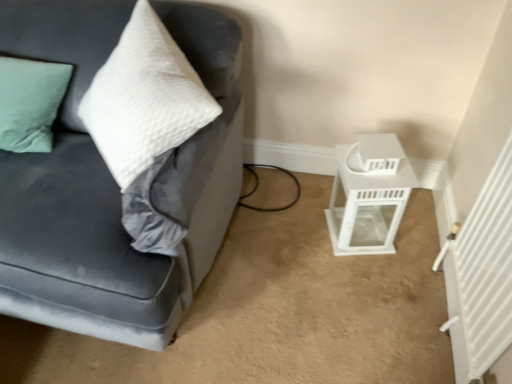
This screenshot has width=512, height=384. Describe the element at coordinates (369, 195) in the screenshot. I see `white glossy lantern at lower right` at that location.

The height and width of the screenshot is (384, 512). Find the location of `white glossy lantern at lower right`. white glossy lantern at lower right is located at coordinates (369, 195).

This screenshot has height=384, width=512. Describe the element at coordinates (93, 201) in the screenshot. I see `velvet gray couch at left` at that location.

You are a GUI agent. You are given a task and a screenshot of the screen. Output one action in this format:
    pyautogui.click(x=<x>, y=<y>)
    Task: Click on the velvet gray couch at left
    Image resolution: width=512 pixels, height=384 pixels.
    Given the screenshot: What is the action you would take?
    pyautogui.click(x=93, y=201)

In order to click on white glossy lantern at lower right in this screenshot , I will do pos(369,195).

Is velvet gray couch at left at the right side of white glossy lantern at lower right?

In fact, velvet gray couch at left is to the left of white glossy lantern at lower right.

Which object is more forward, velvet gray couch at left or white glossy lantern at lower right?

velvet gray couch at left is more forward.

Is point (94, 323) more distant than point (343, 216)?

That is False.

From the image's perspective, is velvet gray couch at left located beneath white glossy lantern at lower right?

No, from the image's perspective, velvet gray couch at left is not beneath white glossy lantern at lower right.

From a real-world perspective, which is physically below, velvet gray couch at left or white glossy lantern at lower right?

white glossy lantern at lower right.

Can you confirm if velvet gray couch at left is thinner than white glossy lantern at lower right?

In fact, velvet gray couch at left might be wider than white glossy lantern at lower right.

Is velvet gray couch at left taller or shorter than white glossy lantern at lower right?

In the image, velvet gray couch at left appears to be taller than white glossy lantern at lower right.

Which of these two, velvet gray couch at left or white glossy lantern at lower right, is smaller?

Smaller between the two is white glossy lantern at lower right.

Is velvet gray couch at left not within white glossy lantern at lower right?

Yes.

Would you say velvet gray couch at left is a long distance from white glossy lantern at lower right?

No.

Is white glossy lantern at lower right at the back of velvet gray couch at left?

No, velvet gray couch at left's orientation is not away from white glossy lantern at lower right.

How different are the orientations of velvet gray couch at left and white glossy lantern at lower right in degrees?

The angle between the facing direction of velvet gray couch at left and the facing direction of white glossy lantern at lower right is 16.9 degrees.

Find the location of a particular element. This screenshot has height=384, width=512. studio couch above the white glossy lantern at lower right (from a real-world perspective) is located at coordinates (93, 201).

Would you say white glossy lantern at lower right is to the left or to the right of velvet gray couch at left in the picture?

From the image, it's evident that white glossy lantern at lower right is to the right of velvet gray couch at left.

Which object is further away from the camera, white glossy lantern at lower right or velvet gray couch at left?

white glossy lantern at lower right.

Which is behind, point (383, 223) or point (54, 178)?

The point (383, 223) is more distant.

From the image's perspective, would you say white glossy lantern at lower right is positioned over velvet gray couch at left?

No, from the image's perspective, white glossy lantern at lower right is not above velvet gray couch at left.

From a real-world perspective, which object rests below the other?

In real-world perspective, white glossy lantern at lower right is lower.

Which object is wider, white glossy lantern at lower right or velvet gray couch at left?

velvet gray couch at left.

Which of these two, white glossy lantern at lower right or velvet gray couch at left, stands shorter?

white glossy lantern at lower right is shorter.

Considering the sizes of objects white glossy lantern at lower right and velvet gray couch at left in the image provided, who is bigger, white glossy lantern at lower right or velvet gray couch at left?

velvet gray couch at left.

Is white glossy lantern at lower right surrounding velvet gray couch at left?

Actually, velvet gray couch at left is outside white glossy lantern at lower right.

Are white glossy lantern at lower right and velvet gray couch at left making contact?

No, white glossy lantern at lower right is not next to velvet gray couch at left.

Is white glossy lantern at lower right aimed at velvet gray couch at left?

No, white glossy lantern at lower right does not turn towards velvet gray couch at left.

How many degrees apart are the facing directions of white glossy lantern at lower right and velvet gray couch at left?

They differ by 16.9 degrees in their facing directions.

Where is `studio couch above the white glossy lantern at lower right (from the image's perspective)`? The image size is (512, 384). studio couch above the white glossy lantern at lower right (from the image's perspective) is located at coordinates (93, 201).

Locate an element on the screen. The width and height of the screenshot is (512, 384). studio couch above the white glossy lantern at lower right (from a real-world perspective) is located at coordinates pyautogui.click(x=93, y=201).

At what (x,y) coordinates should I click in order to perform the action: click on studio couch on the left of white glossy lantern at lower right. Please return your answer as a coordinate pair (x, y). The height and width of the screenshot is (384, 512). Looking at the image, I should click on (93, 201).